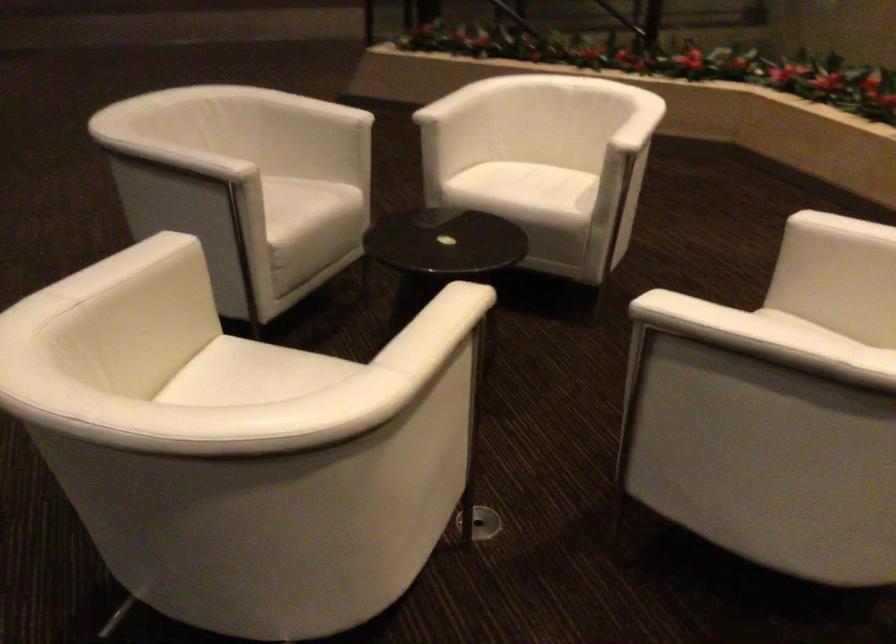
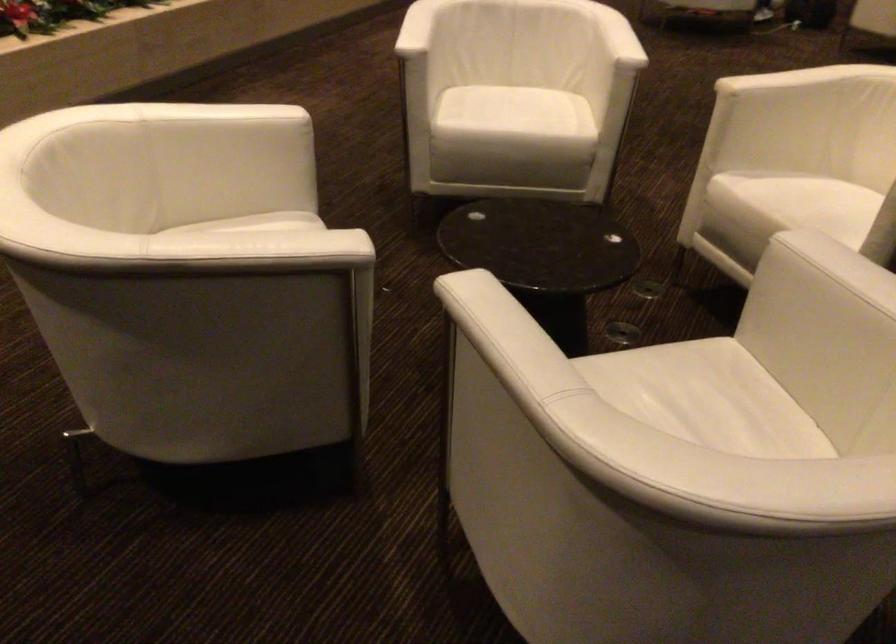
The point at (x=572, y=190) is marked in the first image. Where is the corresponding point in the second image?

(265, 223)